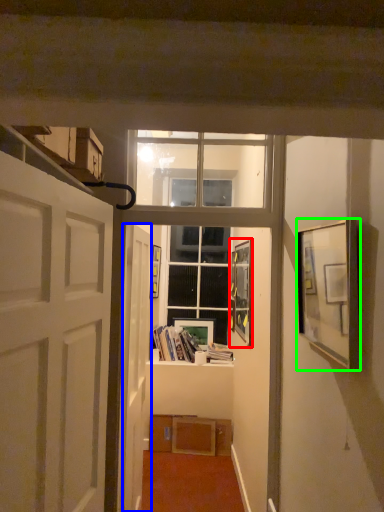
Question: Which object is the closest to the picture frame (highlighted by a red box)? Choose among these: door (highlighted by a blue box) or picture frame (highlighted by a green box).

Choices:
 (A) door
 (B) picture frame

Answer: (A)